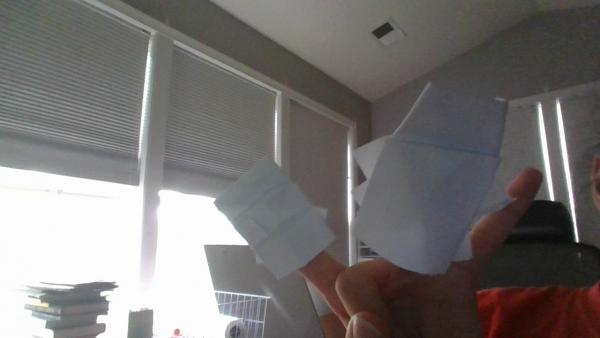
The height and width of the screenshot is (338, 600). Find the location of `windows`. windows is located at coordinates (323, 128), (249, 125), (123, 107).